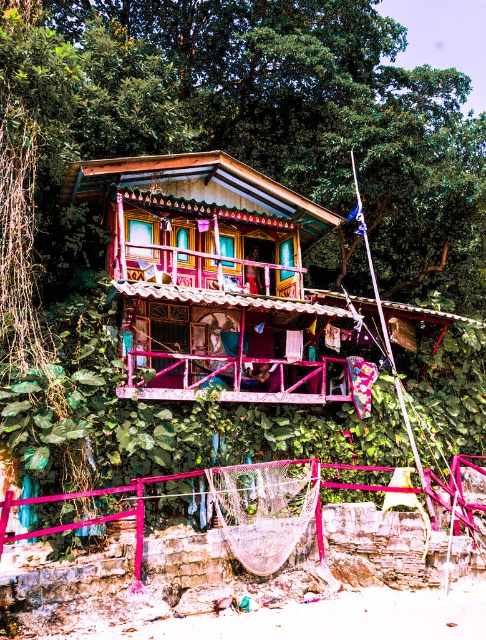
Question: Can you confirm if green leafy tree at upper center is positioned above pink painted wood balcony at center?

Choices:
 (A) no
 (B) yes

Answer: (B)

Question: Is green leafy tree at upper center to the left of multicolored painted hut at center from the viewer's perspective?

Choices:
 (A) yes
 (B) no

Answer: (B)

Question: Considering the real-world distances, which object is closest to the pink metal/rail at center?

Choices:
 (A) pink painted wood balcony at center
 (B) multicolored painted hut at center
 (C) green leafy tree at upper center

Answer: (A)

Question: Can you confirm if green leafy tree at upper center is thinner than pink painted wood balcony at center?

Choices:
 (A) yes
 (B) no

Answer: (B)

Question: Which is nearer to the green leafy tree at upper center?

Choices:
 (A) pink painted wood balcony at center
 (B) multicolored painted hut at center
 (C) pink metal/rail at center

Answer: (A)

Question: Which of these objects is positioned closest to the pink metal/rail at center?

Choices:
 (A) pink painted wood balcony at center
 (B) multicolored painted hut at center

Answer: (A)